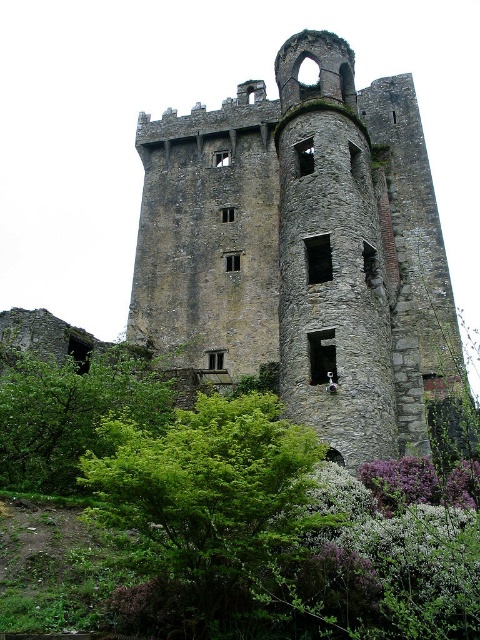
Can you confirm if gray stone tower at center is thinner than green leafy tree at lower left?

Incorrect, gray stone tower at center's width is not less than green leafy tree at lower left's.

Who is lower down, gray stone tower at center or green leafy tree at lower left?

Positioned lower is green leafy tree at lower left.

Identify the location of gray stone tower at center. (302, 250).

Where is `gray stone tower at center`? Image resolution: width=480 pixels, height=640 pixels. gray stone tower at center is located at coordinates (302, 250).

Between green leafy bush at lower center and green leafy tree at lower left, which one appears on the left side from the viewer's perspective?

From the viewer's perspective, green leafy tree at lower left appears more on the left side.

Does green leafy bush at lower center have a lesser width compared to green leafy tree at lower left?

No, green leafy bush at lower center is not thinner than green leafy tree at lower left.

Between point (151, 554) and point (70, 396), which one is positioned in front?

Point (151, 554) is more forward.

The height and width of the screenshot is (640, 480). Find the location of `green leafy bush at lower center`. green leafy bush at lower center is located at coordinates (211, 492).

Describe the element at coordinates (302, 250) in the screenshot. This screenshot has height=640, width=480. I see `gray stone tower at center` at that location.

Between point (256, 147) and point (300, 548), which one is positioned behind?

The point (256, 147) is behind.

The image size is (480, 640). Describe the element at coordinates (302, 250) in the screenshot. I see `gray stone tower at center` at that location.

Where is `gray stone tower at center`? gray stone tower at center is located at coordinates (302, 250).